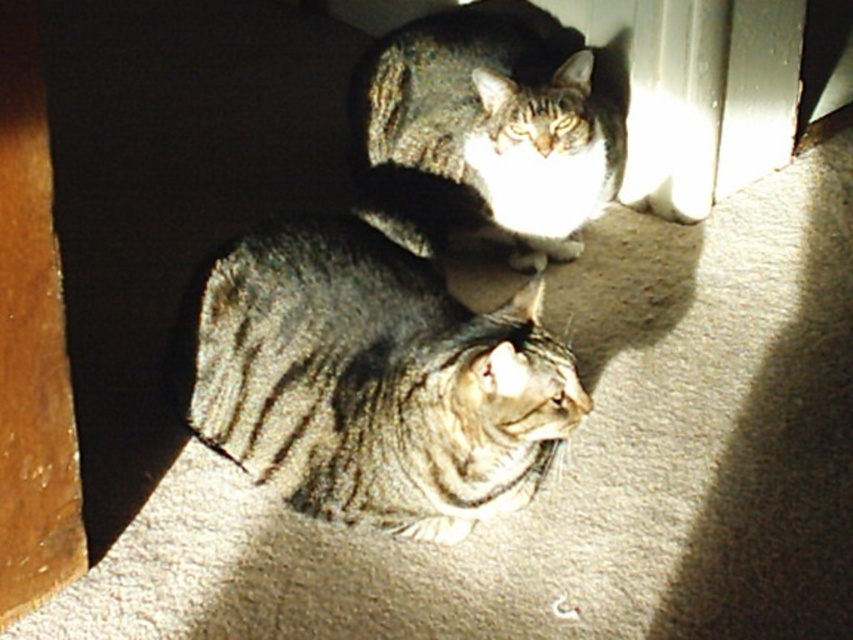
Question: Which object is farther from the camera taking this photo?

Choices:
 (A) tabby fur cat at center
 (B) tabby fur cat at lower center

Answer: (A)

Question: Is tabby fur cat at lower center to the right of tabby fur cat at center from the viewer's perspective?

Choices:
 (A) yes
 (B) no

Answer: (B)

Question: Among these objects, which one is nearest to the camera?

Choices:
 (A) tabby fur cat at center
 (B) tabby fur cat at lower center

Answer: (B)

Question: Is tabby fur cat at lower center closer to the viewer compared to tabby fur cat at center?

Choices:
 (A) yes
 (B) no

Answer: (A)

Question: Does tabby fur cat at lower center appear over tabby fur cat at center?

Choices:
 (A) yes
 (B) no

Answer: (B)

Question: Which of the following is the closest to the observer?

Choices:
 (A) (561, 380)
 (B) (561, 189)

Answer: (A)